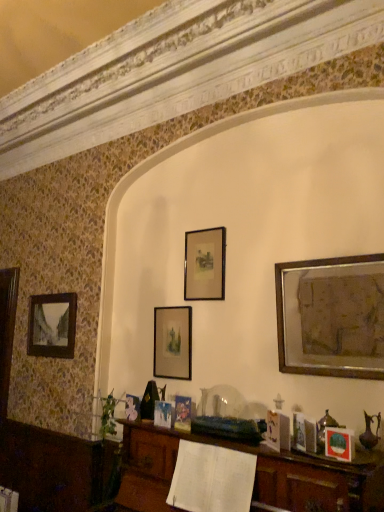
Question: Is matte black picture frame at lower right, the fourth picture frame in the left-to-right sequence, at the back of gold metallic picture frame at upper right, positioned as the 1th picture frame in right-to-left order?

Choices:
 (A) no
 (B) yes

Answer: (A)

Question: Considering the relative sizes of gold metallic picture frame at upper right, which is counted as the fourth picture frame, starting from the back, and matte black picture frame at lower right, the second picture frame in the right-to-left sequence, in the image provided, is gold metallic picture frame at upper right, which is counted as the fourth picture frame, starting from the back, taller than matte black picture frame at lower right, the second picture frame in the right-to-left sequence,?

Choices:
 (A) yes
 (B) no

Answer: (A)

Question: Considering the relative sizes of gold metallic picture frame at upper right, which ranks as the fifth picture frame in left-to-right order, and matte black picture frame at lower right, the second picture frame in the right-to-left sequence, in the image provided, is gold metallic picture frame at upper right, which ranks as the fifth picture frame in left-to-right order, wider than matte black picture frame at lower right, the second picture frame in the right-to-left sequence,?

Choices:
 (A) no
 (B) yes

Answer: (B)

Question: Would you say gold metallic picture frame at upper right, the second picture frame in the front-to-back sequence, is a long distance from matte black picture frame at lower right, the fourth picture frame in the left-to-right sequence?

Choices:
 (A) yes
 (B) no

Answer: (B)

Question: Does gold metallic picture frame at upper right, positioned as the 1th picture frame in right-to-left order, have a larger size compared to matte black picture frame at lower right, the fourth picture frame in the left-to-right sequence?

Choices:
 (A) no
 (B) yes

Answer: (B)

Question: From the image's perspective, relative to gold metallic picture frame at upper right, which ranks as the fifth picture frame in left-to-right order, is matte black picture frame at lower right, marked as the fifth picture frame in a back-to-front arrangement, above or below?

Choices:
 (A) below
 (B) above

Answer: (A)

Question: Is matte black picture frame at lower right, the second picture frame in the right-to-left sequence, wider or thinner than gold metallic picture frame at upper right, which ranks as the fifth picture frame in left-to-right order?

Choices:
 (A) thin
 (B) wide

Answer: (A)

Question: Is matte black picture frame at lower right, marked as the fifth picture frame in a back-to-front arrangement, in front of or behind gold metallic picture frame at upper right, which is counted as the fourth picture frame, starting from the back, in the image?

Choices:
 (A) front
 (B) behind

Answer: (A)

Question: Is matte black picture frame at lower right, the second picture frame in the right-to-left sequence, situated inside gold metallic picture frame at upper right, the second picture frame in the front-to-back sequence, or outside?

Choices:
 (A) inside
 (B) outside

Answer: (B)

Question: Does point (36, 320) appear closer or farther from the camera than point (170, 335)?

Choices:
 (A) farther
 (B) closer

Answer: (A)

Question: From a real-world perspective, relative to matte black picture frame at center, acting as the second picture frame starting from the left, is matte black picture frame at left, acting as the first picture frame starting from the back, vertically above or below?

Choices:
 (A) below
 (B) above

Answer: (B)

Question: Is matte black picture frame at left, marked as the fifth picture frame in a front-to-back arrangement, in front of or behind matte black picture frame at center, which is the 2th picture frame from back to front, in the image?

Choices:
 (A) front
 (B) behind

Answer: (B)

Question: Visually, is matte black picture frame at left, acting as the 1th picture frame starting from the left, positioned to the left or to the right of matte black picture frame at center, acting as the second picture frame starting from the left?

Choices:
 (A) right
 (B) left

Answer: (B)

Question: Based on their positions, is matte black picture frame at center, which is counted as the fourth picture frame, starting from the front, located to the left or right of matte black picture frame at lower right, which appears as the first picture frame when viewed from the front?

Choices:
 (A) left
 (B) right

Answer: (A)

Question: From their relative heights in the image, would you say matte black picture frame at center, which is counted as the fourth picture frame, starting from the front, is taller or shorter than matte black picture frame at lower right, the fourth picture frame in the left-to-right sequence?

Choices:
 (A) short
 (B) tall

Answer: (B)